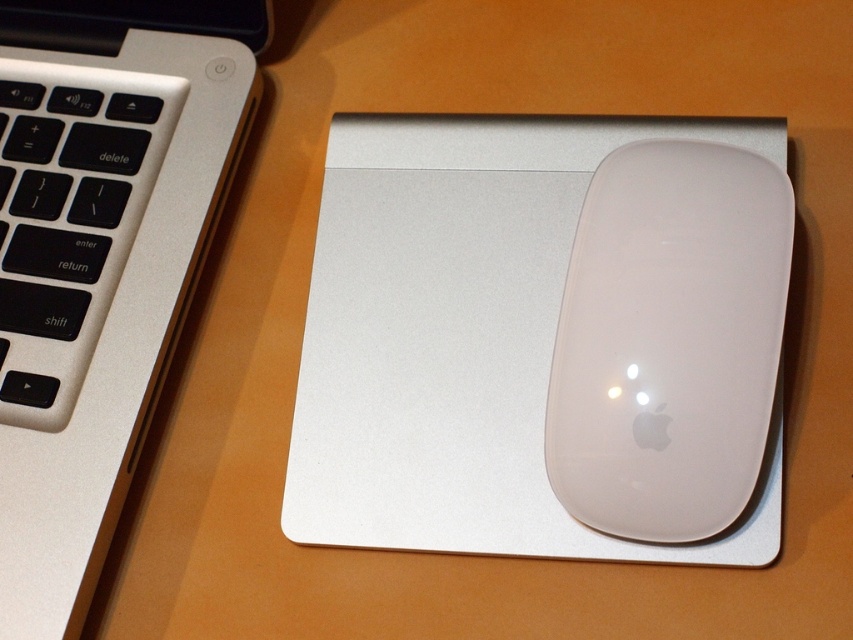
You are setting up your desk and want to place a new object between the white matte mouse pad at center and the silver metallic keyboard at upper left. Based on their heights, which object should be placed lower?

The white matte mouse pad at center has a lesser height compared to the silver metallic keyboard at upper left, so the white matte mouse pad at center should be placed lower.

You are a photographer adjusting your camera to capture the workspace setup. You notice two points marked in the scene. Which point, point (769, 177) or point (27, 285), is closer to your camera lens?

Point (769, 177) is closer to the camera lens than point (27, 285).